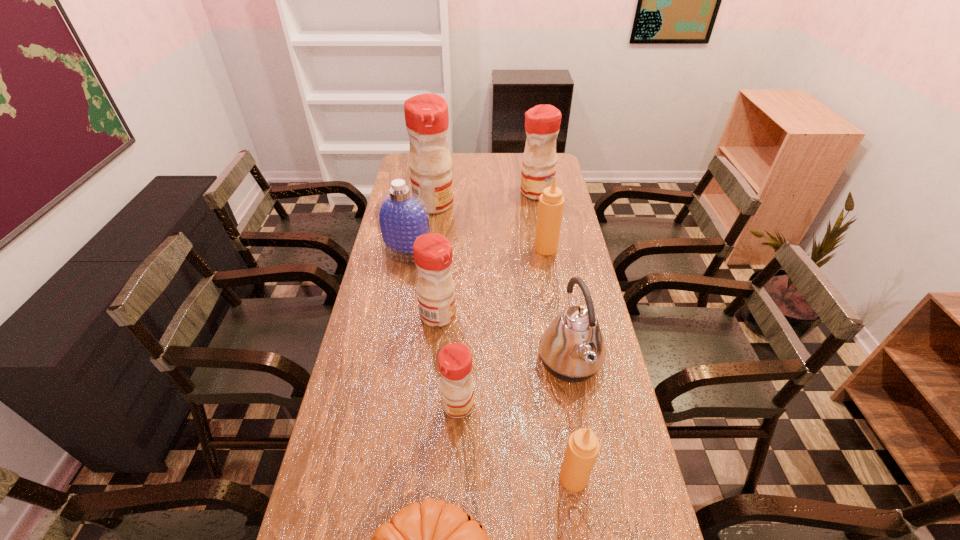
Choose which red condiment is the second nearest neighbor to the tallest condiment. Please provide its 2D coordinates. Your answer should be formatted as a tuple, i.e. [(x, y)], where the tuple contains the x and y coordinates of a point satisfying the conditions above.

[(433, 255)]

This screenshot has height=540, width=960. What are the coordinates of `vacant point that satisfies the following two spatial constraints: 1. on the back side of the eighth shortest object; 2. on the left side of the cleansing agent` in the screenshot? It's located at (419, 192).

At what (x,y) coordinates should I click in order to perform the action: click on vacant space that satisfies the following two spatial constraints: 1. on the front side of the tallest condiment; 2. on the left side of the second nearest object. Please return your answer as a coordinate pair (x, y). Looking at the image, I should click on (396, 478).